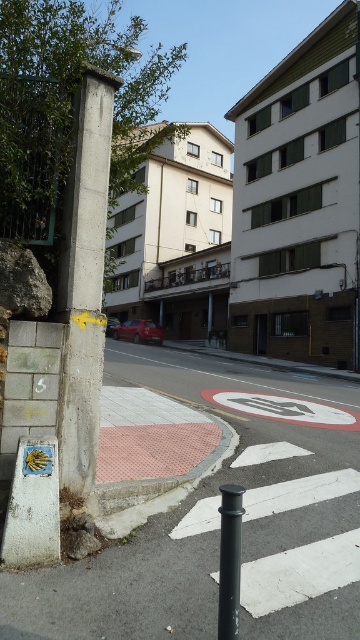
You are a delivery person who needs to park your bike between the concrete pole at center and the black metal pole at lower center. Based on the scene description, can you fit your bike there?

The concrete pole at center is to the left of the black metal pole at lower center, so there is space between them to park the bike.

You are standing on the sidewalk and want to cross the street to reach the park on the other side. The park entrance is located 5 meters away from where you are. Can you safely walk straight ahead without passing the concrete pole at center?

The concrete pole at center is 4.83 meters away from you. Since the park entrance is 5 meters away, you can walk straight ahead and pass the concrete pole at center before reaching the park entrance.